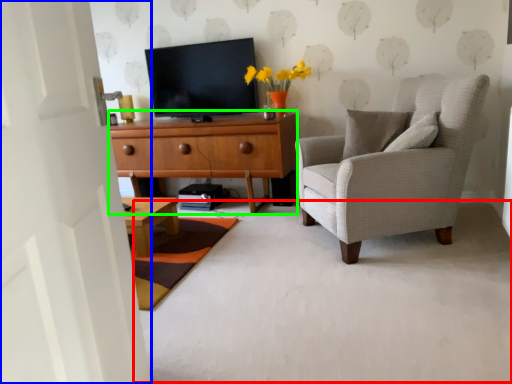
Question: Based on their relative distances, which object is nearer to plain (highlighted by a red box)? Choose from door (highlighted by a blue box) and cabinetry (highlighted by a green box).

Choices:
 (A) door
 (B) cabinetry

Answer: (A)